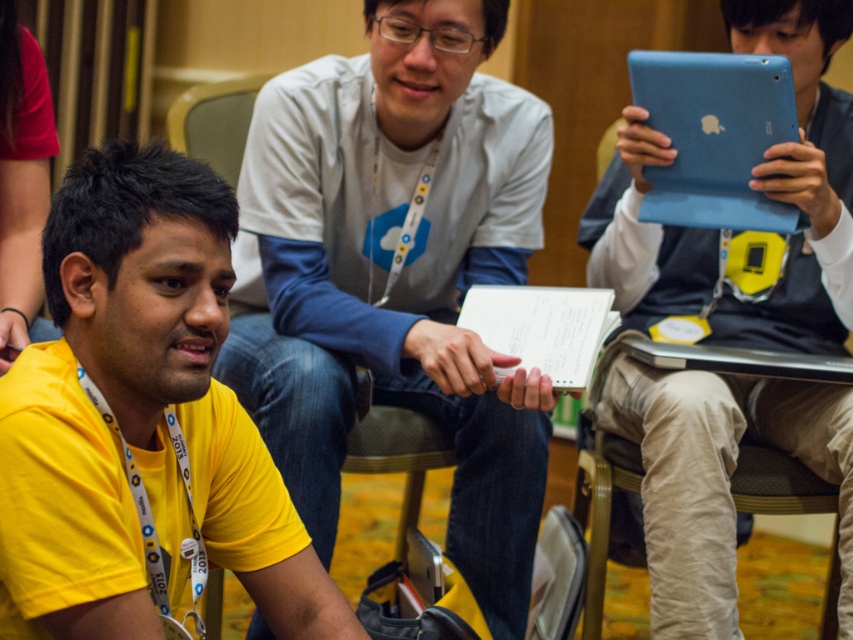
You are in a conference room and need to locate two specific points marked on the floor. The first point is at coordinates point (328, 113) and the second at point (119, 394). From your current position facing north, which point is located behind the other?

Point (328, 113) is behind point (119, 394).

You are sitting at the back of the conference room and want to see the white matte shirt at center. Is the blue matte tablet at center blocking your view of it?

The blue matte tablet at center is behind the white matte shirt at center, so it is not blocking the view of the white matte shirt at center.